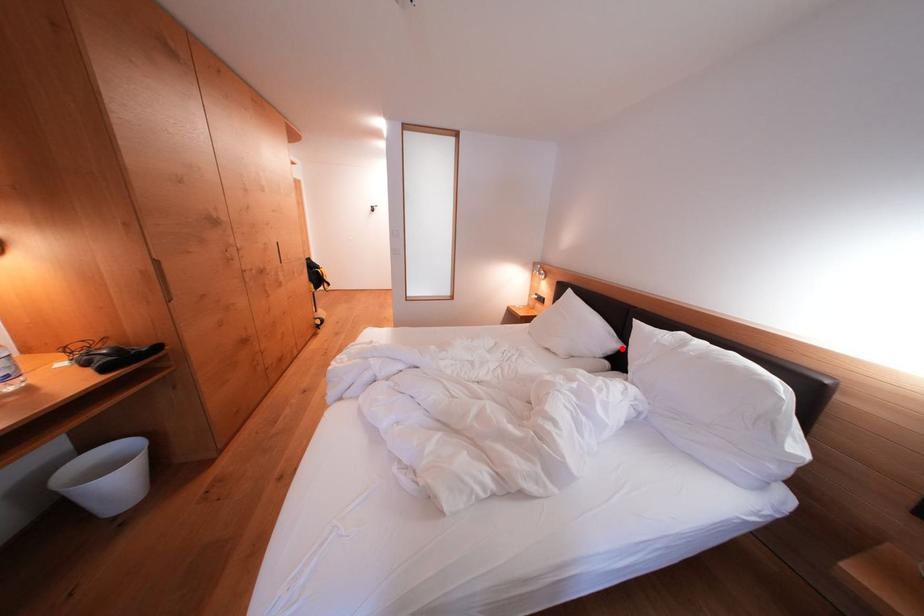
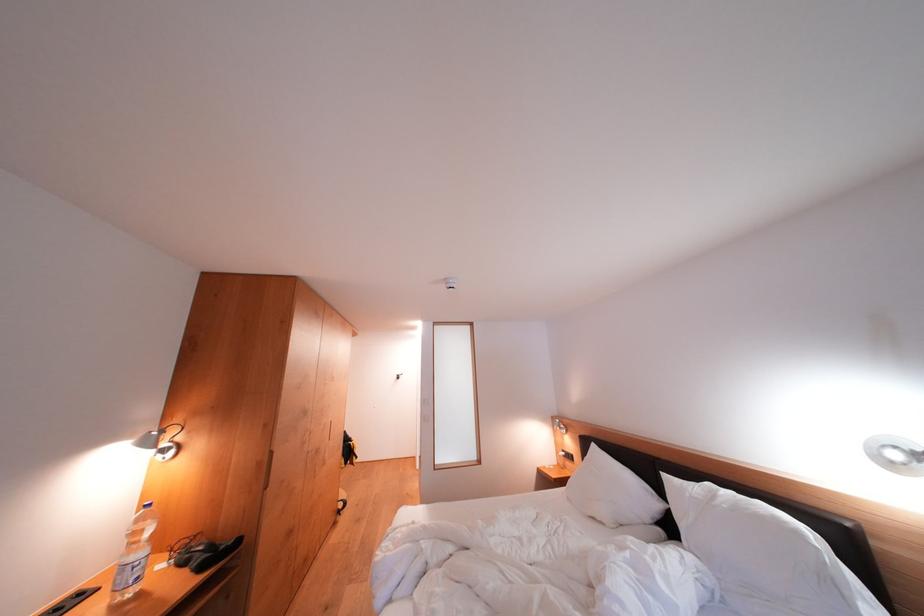
Question: I am providing you with two images of the same scene from different viewpoints. A red point is marked on the first image. Can you still see the location of the red point in image 2?

Choices:
 (A) Yes
 (B) No

Answer: (A)